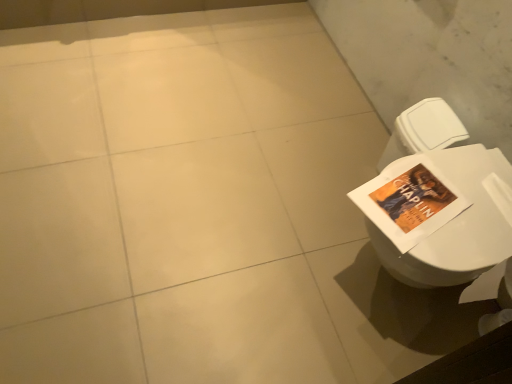
What is the approximate width of white glossy toilet at right?

white glossy toilet at right is 21.90 inches in width.

Find the location of a particular element. The height and width of the screenshot is (384, 512). white glossy toilet at right is located at coordinates (435, 202).

What do you see at coordinates (435, 202) in the screenshot? The image size is (512, 384). I see `white glossy toilet at right` at bounding box center [435, 202].

Identify the location of white glossy toilet at right. (435, 202).